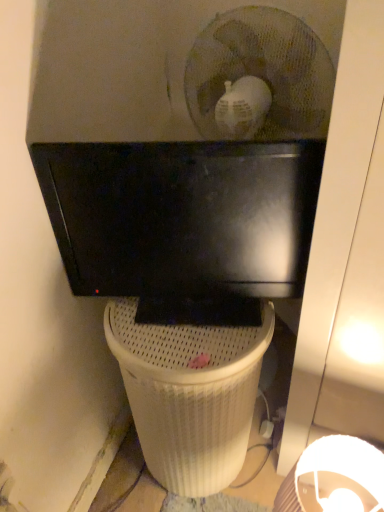
Question: From a real-world perspective, is matte black monitor at upper center beneath white mesh waste container at center?

Choices:
 (A) no
 (B) yes

Answer: (A)

Question: Is matte black monitor at upper center looking in the opposite direction of white mesh waste container at center?

Choices:
 (A) no
 (B) yes

Answer: (A)

Question: From a real-world perspective, is matte black monitor at upper center physically above white mesh waste container at center?

Choices:
 (A) no
 (B) yes

Answer: (B)

Question: Are matte black monitor at upper center and white mesh waste container at center making contact?

Choices:
 (A) yes
 (B) no

Answer: (B)

Question: Is matte black monitor at upper center to the right of white mesh waste container at center from the viewer's perspective?

Choices:
 (A) yes
 (B) no

Answer: (A)

Question: Can you confirm if matte black monitor at upper center is wider than white mesh waste container at center?

Choices:
 (A) no
 (B) yes

Answer: (A)

Question: From the image's perspective, is white mesh waste container at center above matte black monitor at upper center?

Choices:
 (A) no
 (B) yes

Answer: (A)

Question: Is white mesh waste container at center next to matte black monitor at upper center?

Choices:
 (A) no
 (B) yes

Answer: (A)

Question: Does white mesh waste container at center have a smaller size compared to matte black monitor at upper center?

Choices:
 (A) no
 (B) yes

Answer: (A)

Question: From a real-world perspective, is white mesh waste container at center under matte black monitor at upper center?

Choices:
 (A) yes
 (B) no

Answer: (A)

Question: Does white mesh waste container at center come in front of matte black monitor at upper center?

Choices:
 (A) no
 (B) yes

Answer: (A)

Question: Does white mesh waste container at center have a lesser height compared to matte black monitor at upper center?

Choices:
 (A) yes
 (B) no

Answer: (B)

Question: From a real-world perspective, is white mesh waste container at center above or below matte black monitor at upper center?

Choices:
 (A) above
 (B) below

Answer: (B)